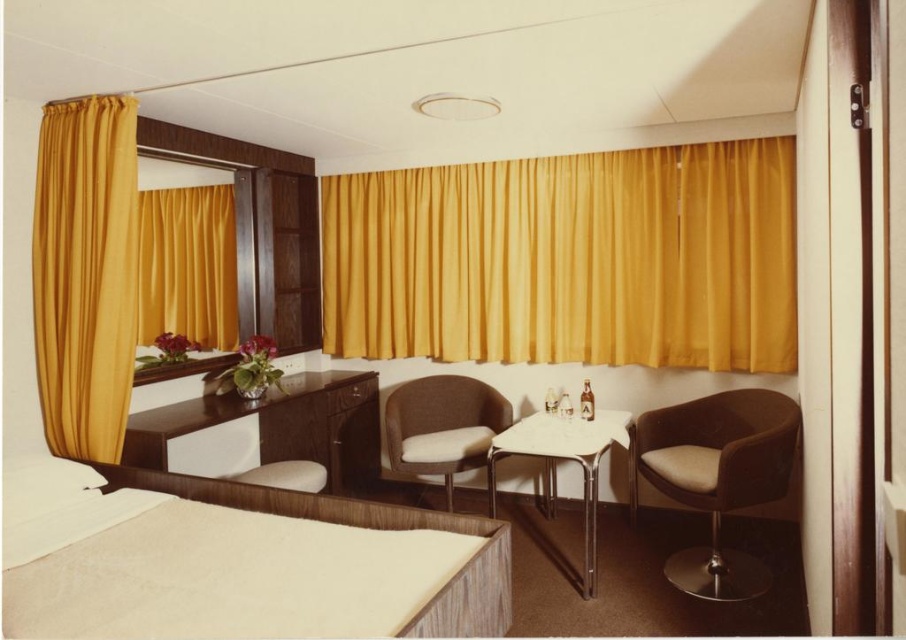
Question: Is matte yellow curtain at left thinner than matte brown armchair at center?

Choices:
 (A) yes
 (B) no

Answer: (A)

Question: Which object appears farthest from the camera in this image?

Choices:
 (A) matte brown armchair at center
 (B) brown leather armchair at right

Answer: (A)

Question: Can you confirm if brown leather armchair at right is positioned to the left of matte brown armchair at center?

Choices:
 (A) yes
 (B) no

Answer: (B)

Question: Which of these objects is positioned closest to the matte yellow curtain at left?

Choices:
 (A) matte brown armchair at center
 (B) white glossy table at center

Answer: (A)

Question: Does yellow fabric curtain at center come behind matte yellow curtain at left?

Choices:
 (A) yes
 (B) no

Answer: (A)

Question: Which object is positioned farthest from the white glossy table at center?

Choices:
 (A) matte black desk at center
 (B) brown leather armchair at right

Answer: (A)